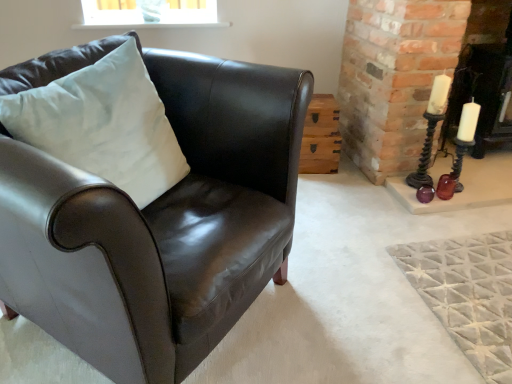
Where is `free space on the front side of wooden crate at center-right`? This screenshot has height=384, width=512. free space on the front side of wooden crate at center-right is located at coordinates [318, 180].